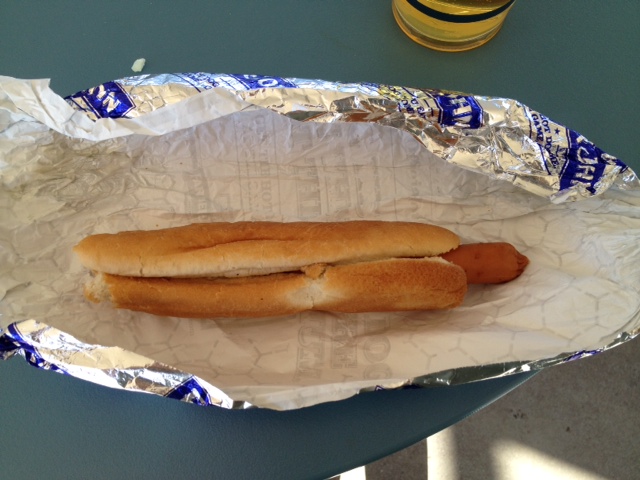
Where is `light on floor`? The height and width of the screenshot is (480, 640). light on floor is located at coordinates (16, 397), (36, 325), (6, 265).